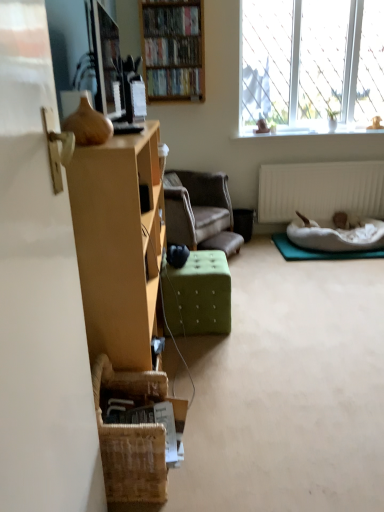
Find the location of a particular element. This screenshot has width=384, height=512. vacant area located to the right-hand side of brown woven basket at lower left is located at coordinates (208, 464).